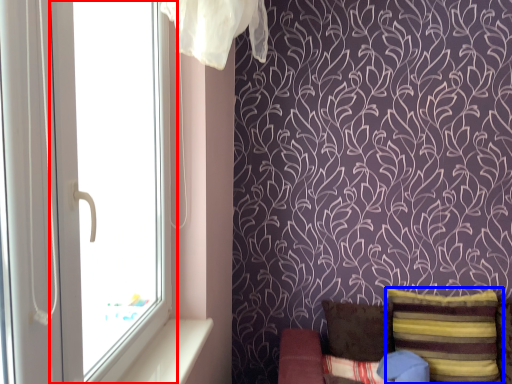
Question: Which point is closer to the camera, window (highlighted by a red box) or pillow (highlighted by a blue box)?

Choices:
 (A) window
 (B) pillow

Answer: (A)